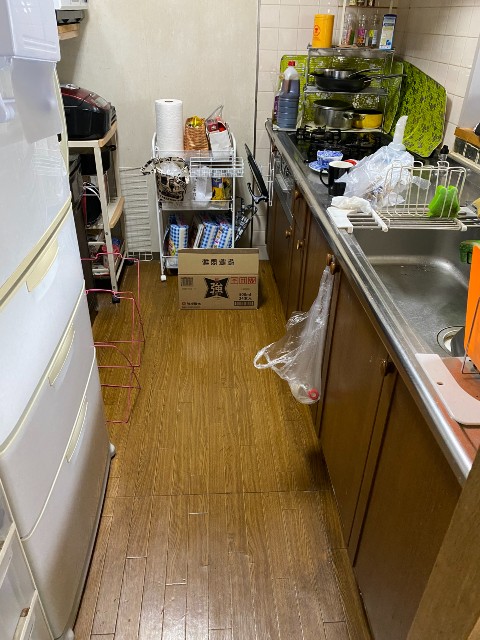
Locate an element on the screen. The height and width of the screenshot is (640, 480). cabinet knobs is located at coordinates (287, 235), (296, 244), (294, 196), (325, 257), (329, 267), (382, 372).